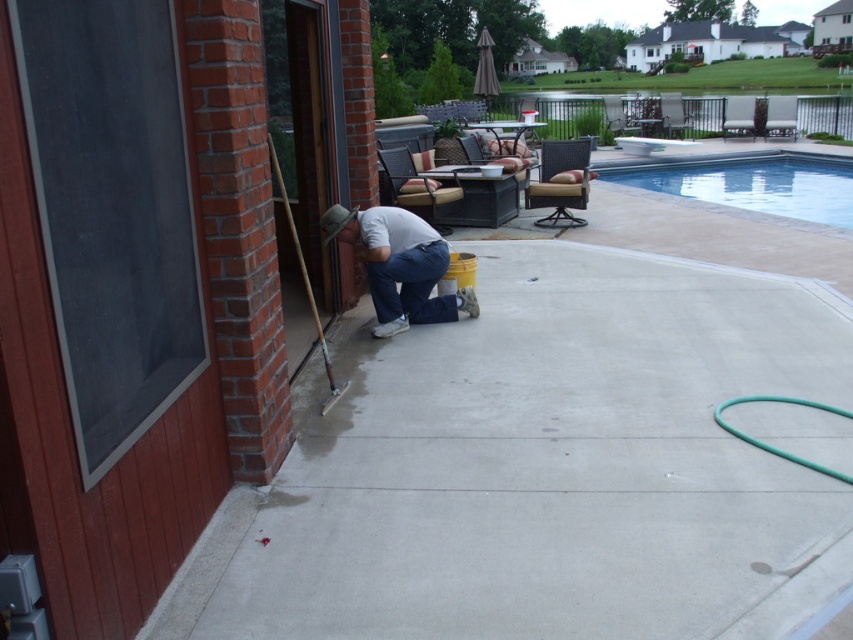
You are standing on the patio and want to move from the clear glass swimming pool at upper right to the denim jeans at lower center. What is the approximate distance you need to cover?

The clear glass swimming pool at upper right and denim jeans at lower center are 9.59 meters apart, so you need to cover approximately 9.6 meters.

You are standing at the point marked by the man kneeling on the concrete surface. Which of the two points, point (509, 272) or point (360, 211), is closer to you?

Point (360, 211) is closer to you because it is in front of point (509, 272), which is behind it.

You are a contractor assessing the patio area. The smooth concrete at center and denim jeans at lower center are both in your view. Which object occupies more space in the scene?

The smooth concrete at center has a larger size compared to denim jeans at lower center, so it occupies more space in the scene.